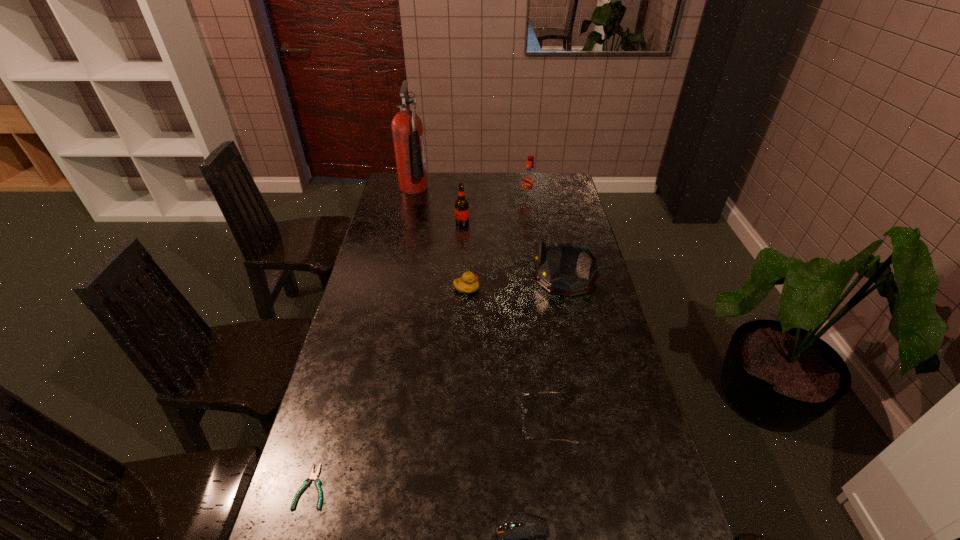
Locate an element on the screen. The width and height of the screenshot is (960, 540). the tallest object is located at coordinates (407, 129).

This screenshot has height=540, width=960. I want to click on the farther root beer, so click(x=529, y=179).

Locate an element on the screen. the left root beer is located at coordinates (461, 205).

Identify the location of the sixth nearest object. Image resolution: width=960 pixels, height=540 pixels. pyautogui.click(x=461, y=205).

At what (x,y) coordinates should I click in order to perform the action: click on tiara. Please return your answer as a coordinate pair (x, y). Looking at the image, I should click on (571, 252).

Identify the location of the fifth tallest object. (467, 284).

What are the coordinates of `spectacles` in the screenshot? It's located at (524, 433).

Locate an element on the screen. pliers is located at coordinates (313, 476).

Locate an element on the screen. the seventh farthest object is located at coordinates (313, 476).

Image resolution: width=960 pixels, height=540 pixels. Find the location of `vacant area located on the front of the tallest object near the operation label`. vacant area located on the front of the tallest object near the operation label is located at coordinates tap(494, 187).